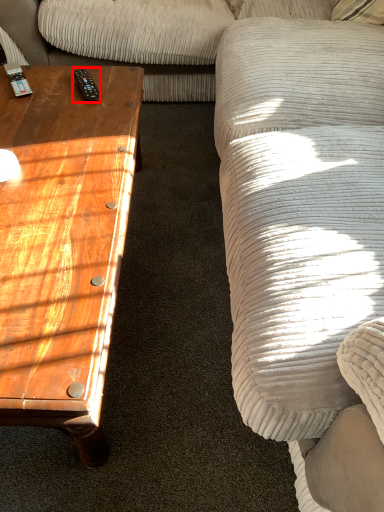
Question: Considering the relative positions of remote (annotated by the red box) and coffee table in the image provided, where is remote (annotated by the red box) located with respect to the staircase?

Choices:
 (A) left
 (B) right

Answer: (B)